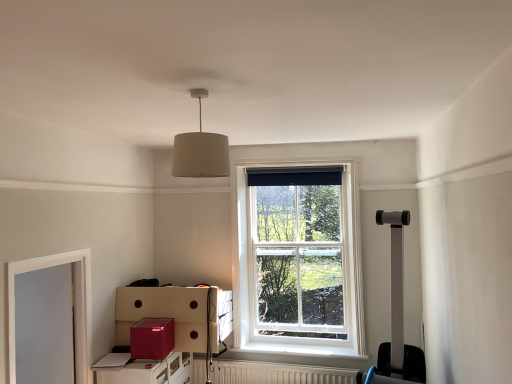
Where is `vacant space underneath dark blue fabric at upper center (from a real-world perspective)`? This screenshot has width=512, height=384. vacant space underneath dark blue fabric at upper center (from a real-world perspective) is located at coordinates (285, 345).